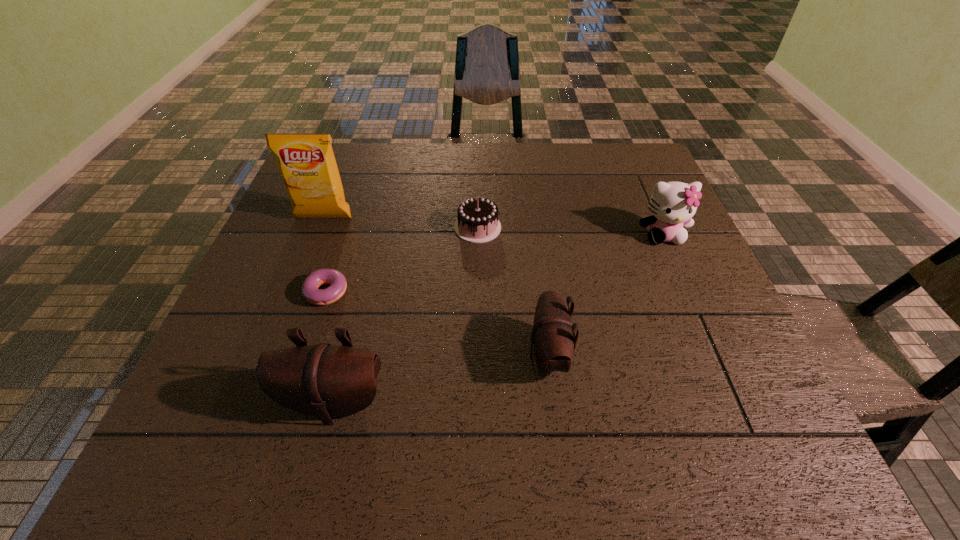
I want to click on vacant space at the near edge of the desktop, so click(x=562, y=402).

In the image, there is a desktop. In order to click on free space at the left edge in this screenshot , I will do `click(236, 346)`.

The width and height of the screenshot is (960, 540). In the image, there is a desktop. Identify the location of vacant space at the right edge. (669, 250).

Find the location of `vacant space at the far left corner of the desktop`. vacant space at the far left corner of the desktop is located at coordinates (364, 151).

You are a GUI agent. You are given a task and a screenshot of the screen. Output one action in this format:
    pyautogui.click(x=<x>, y=<y>)
    Task: Click on the blank space at the far right corner of the desktop
    The image size is (960, 540).
    Given the screenshot: What is the action you would take?
    pyautogui.click(x=636, y=171)

This screenshot has width=960, height=540. I want to click on vacant space at the near right corner of the desktop, so click(756, 382).

Find the location of a particular element. The height and width of the screenshot is (540, 960). free space between the rightmost object and the third shortest object is located at coordinates (606, 295).

The image size is (960, 540). Find the location of `free space between the taller pouch and the rightmost object`. free space between the taller pouch and the rightmost object is located at coordinates (498, 319).

At what (x,y) coordinates should I click in order to perform the action: click on free space between the kitten and the doughnut. Please return your answer as a coordinate pair (x, y). Image resolution: width=960 pixels, height=540 pixels. Looking at the image, I should click on click(497, 264).

The image size is (960, 540). I want to click on empty space that is in between the kitten and the taller pouch, so click(498, 319).